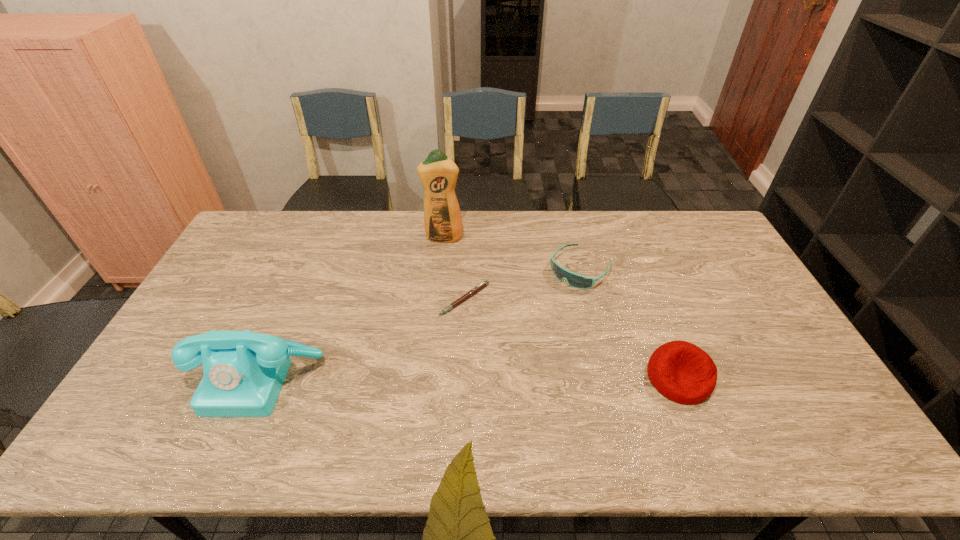
Identify the location of vacant space that is in between the sunglasses and the detergent. (512, 253).

The height and width of the screenshot is (540, 960). I want to click on vacant region between the tallest object and the third shortest object, so click(x=561, y=308).

Find the location of `free space that is in between the fourth tallest object and the third tallest object`. free space that is in between the fourth tallest object and the third tallest object is located at coordinates (630, 323).

Where is `unoccupied position between the rightmost object and the sunglasses`? The height and width of the screenshot is (540, 960). unoccupied position between the rightmost object and the sunglasses is located at coordinates (630, 323).

The width and height of the screenshot is (960, 540). What are the coordinates of `free spot between the detergent and the beanbag` in the screenshot? It's located at (561, 308).

At what (x,y) coordinates should I click in order to perform the action: click on vacant point located between the tallest object and the beanbag. Please return your answer as a coordinate pair (x, y). This screenshot has width=960, height=540. Looking at the image, I should click on tap(561, 308).

This screenshot has width=960, height=540. I want to click on free spot between the pen and the beanbag, so click(x=571, y=339).

I want to click on free spot between the tallest object and the telephone, so click(x=352, y=308).

Locate which object ranks third in proximity to the shortest object. Please provide its 2D coordinates. Your answer should be formatted as a tuple, i.e. [(x, y)], where the tuple contains the x and y coordinates of a point satisfying the conditions above.

[(243, 372)]

Identify which object is located as the nearest to the shortest object. Please provide its 2D coordinates. Your answer should be formatted as a tuple, i.e. [(x, y)], where the tuple contains the x and y coordinates of a point satisfying the conditions above.

[(438, 173)]